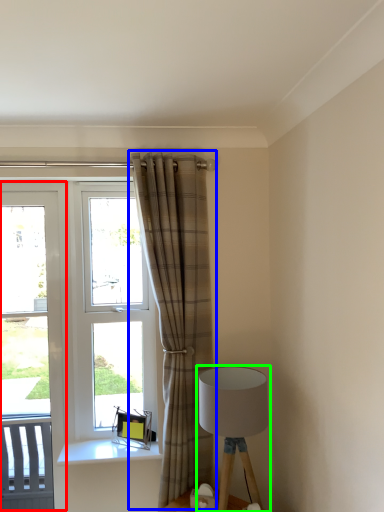
Question: Considering the real-world distances, which object is farthest from screen door (highlighted by a red box)? curtain (highlighted by a blue box) or lamp (highlighted by a green box)?

Choices:
 (A) curtain
 (B) lamp

Answer: (B)